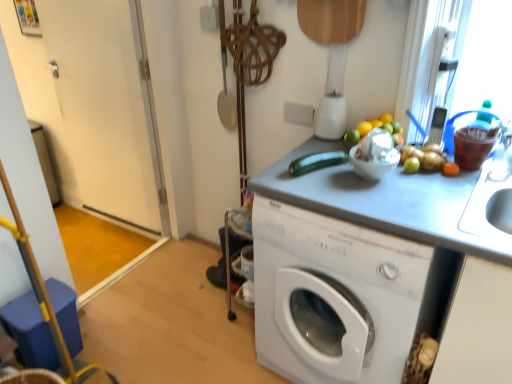
Find the location of a particular element. Image resolution: width=512 pixels, height=384 pixels. vacant point to the left of green matte zucchini at center is located at coordinates (283, 172).